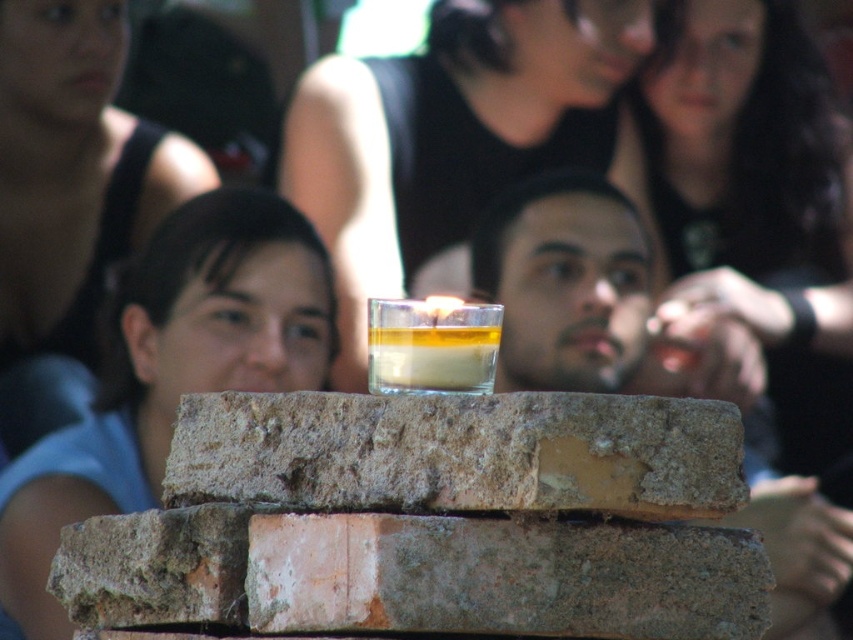
You are setting up a small table for a tea ceremony. You have a rusty concrete block at center and a translucent glass cup at center. Where should you place the cup to avoid it falling over?

The translucent glass cup at center should be placed on top of the rusty concrete block at center since the block is below the cup, providing a stable base.

You are a photographer adjusting the lighting for a closeup shot of the matte black hair at center and the translucent glass cup at center. The camera requires both subjects to be within a 15 inch focus range to capture them clearly. Based on their distance, will both subjects be in focus?

The matte black hair at center is 17.47 inches from the translucent glass cup at center. Since the distance between them exceeds the camera requirement of 15 inches, the subjects will not both be in focus.